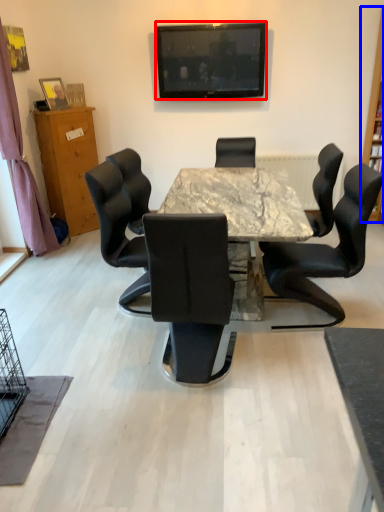
Question: Which object appears farthest to the camera in this image, television (highlighted by a red box) or bookshelf (highlighted by a blue box)?

Choices:
 (A) television
 (B) bookshelf

Answer: (A)